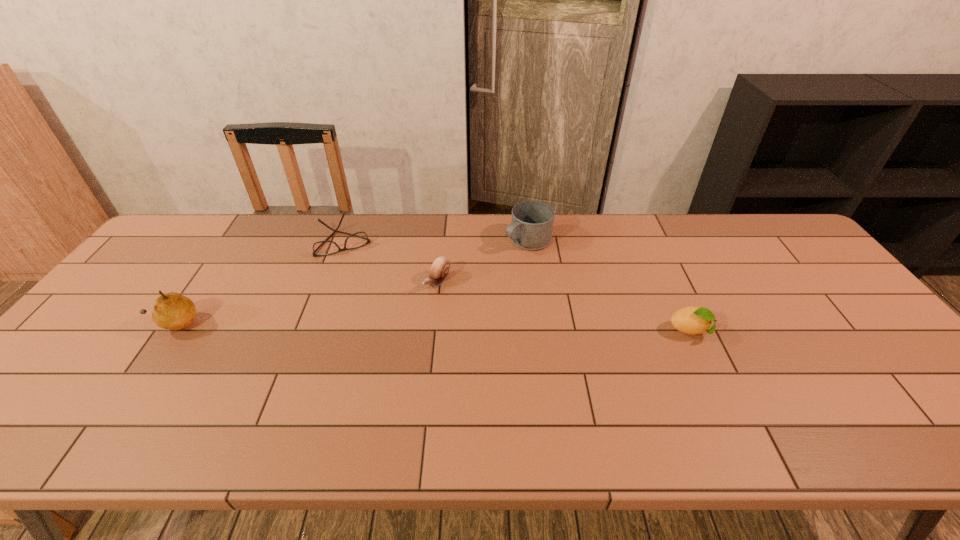
Find the location of a particular element. The image size is (960, 540). free space on the desktop that is between the leftmost object and the rightmost object and is positioned on the side of the mug with the handle is located at coordinates (396, 327).

At what (x,y) coordinates should I click in order to perform the action: click on vacant spot on the desktop that is between the leftmost object and the rightmost object and is positioned on the front-facing side of the second object from left to right. Please return your answer as a coordinate pair (x, y). Looking at the image, I should click on (373, 327).

Image resolution: width=960 pixels, height=540 pixels. Find the location of `free space on the desktop that is between the leftmost object and the lemon and is positioned on the front-facing side of the third object from right to left`. free space on the desktop that is between the leftmost object and the lemon and is positioned on the front-facing side of the third object from right to left is located at coordinates tap(387, 327).